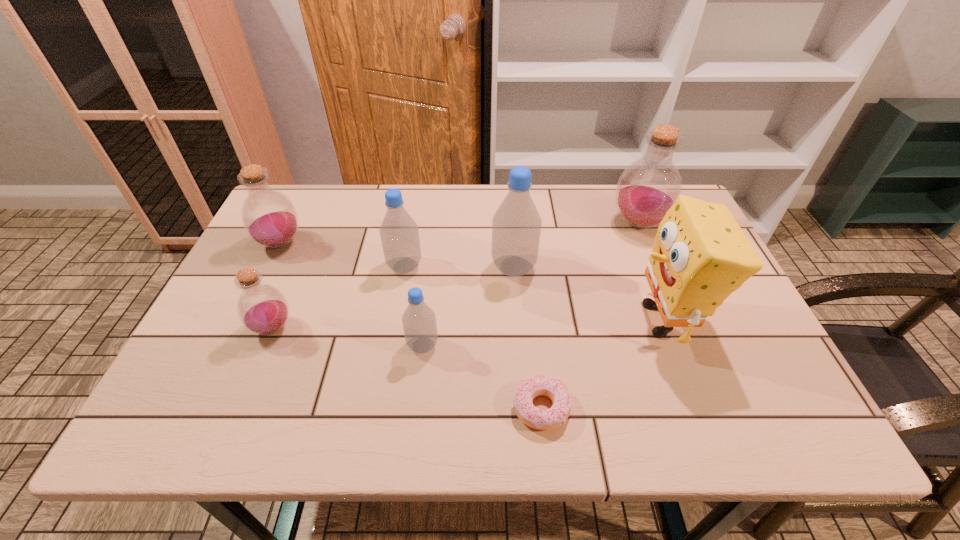
Locate an element on the screen. vacant area located on the left of the nearest object is located at coordinates (320, 408).

The image size is (960, 540). I want to click on object at the near edge, so click(555, 389).

Identify the location of bottle located at the right edge. The image size is (960, 540). (648, 187).

Identify the location of sponge that is at the right edge. (700, 255).

Locate an element on the screen. The image size is (960, 540). object at the far left corner is located at coordinates (269, 217).

Find the location of `object that is positioned at the far right corner`. object that is positioned at the far right corner is located at coordinates (648, 187).

In the image, there is a desktop. Where is `vacant space at the far edge`? The width and height of the screenshot is (960, 540). vacant space at the far edge is located at coordinates (444, 208).

Find the location of a particular element. The width and height of the screenshot is (960, 540). blank area at the near edge is located at coordinates (698, 422).

This screenshot has height=540, width=960. I want to click on free location at the left edge, so click(x=305, y=247).

This screenshot has height=540, width=960. Find the location of `free spot at the far left corner of the desktop`. free spot at the far left corner of the desktop is located at coordinates (290, 191).